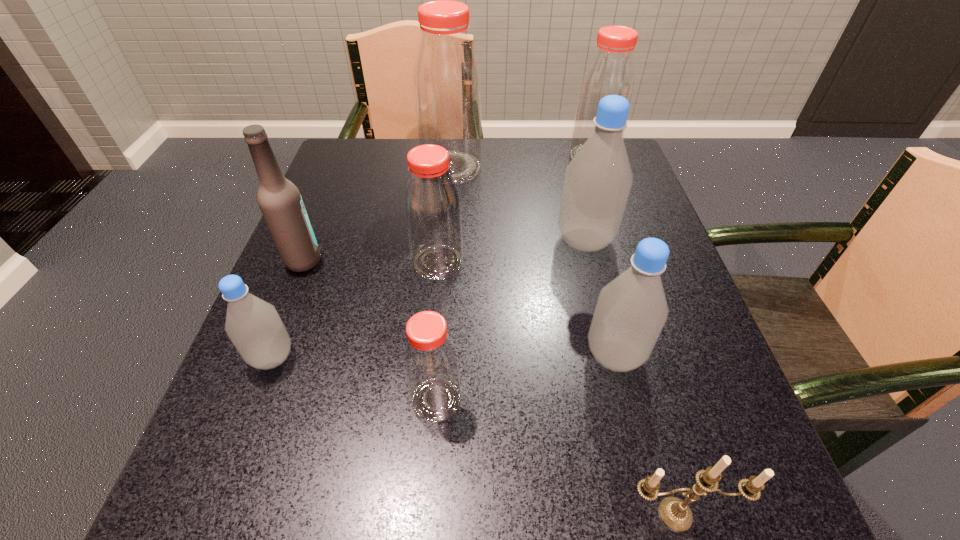
In the image, there is a desktop. Identify the location of vacant space at the right edge. The width and height of the screenshot is (960, 540). [688, 320].

Find the location of a particular element. vacant region at the far left corner is located at coordinates (376, 170).

The image size is (960, 540). In order to click on vacant space at the near left corner in this screenshot , I will do `click(294, 500)`.

At what (x,y) coordinates should I click in order to perform the action: click on free spot between the beer bottle and the metallic candle. Please return your answer as a coordinate pair (x, y). This screenshot has height=540, width=960. Looking at the image, I should click on (490, 387).

Locate an element on the screen. The width and height of the screenshot is (960, 540). free space between the smallest red bottle and the second biggest red bottle is located at coordinates (515, 279).

This screenshot has height=540, width=960. What are the coordinates of `empty space that is in between the beer bottle and the leftmost gray bottle` in the screenshot? It's located at (x=288, y=309).

Where is `empty location between the leftmost bottle and the biggest gray bottle`? This screenshot has height=540, width=960. empty location between the leftmost bottle and the biggest gray bottle is located at coordinates (428, 299).

You are a GUI agent. You are given a task and a screenshot of the screen. Output one action in this format:
    pyautogui.click(x=<x>, y=<y>)
    Task: Click on the vacant region between the second biggest gray bottle and the biggest red bottle
    The image size is (960, 540).
    Given the screenshot: What is the action you would take?
    pyautogui.click(x=533, y=261)

Locate an element on the screen. empty space that is in between the beer bottle and the nearest red bottle is located at coordinates (370, 330).

This screenshot has width=960, height=540. I want to click on empty space that is in between the metallic candle and the biggest gray bottle, so click(630, 377).